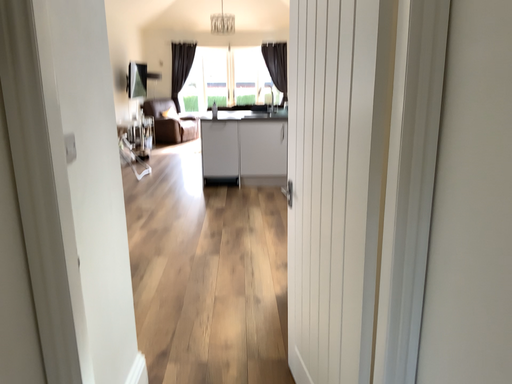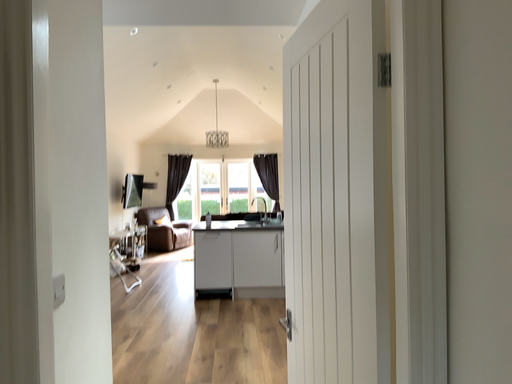
Question: Which way did the camera rotate in the video?

Choices:
 (A) rotated upward
 (B) rotated downward

Answer: (A)